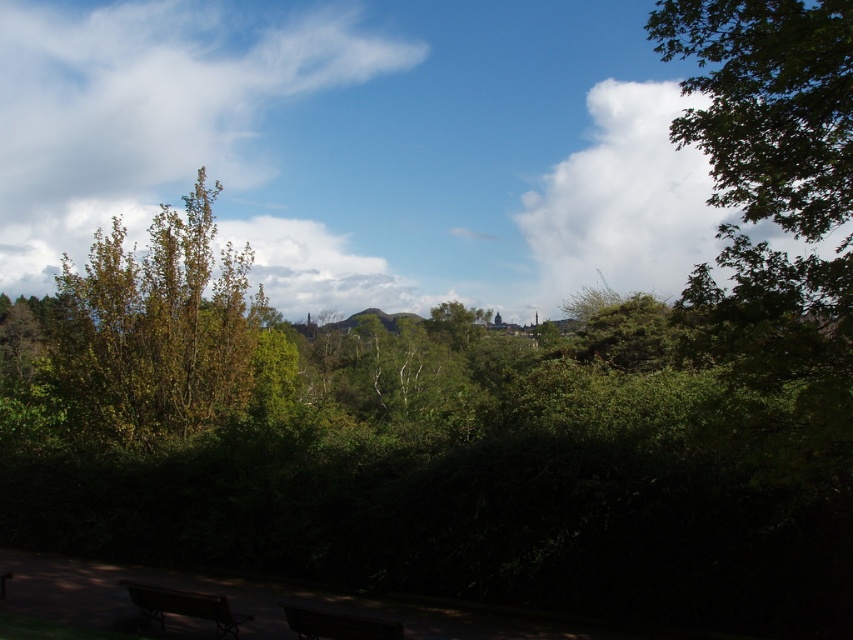
You are an architect designing a new park layout. You want to place a large statue exactly at the center of the park. However, you need to ensure that the statue does not block the view of the distant town from the white fluffy cloud at upper left. Given the coordinates of the cloud, can you determine if placing the statue at the center would block the view? Assume the park is a rectangle with coordinates from 0 to 1 on both axes.

The white fluffy cloud at upper left is located at coordinates point (173, 134). Since the statue is placed at the center of the park, which would be at coordinates (426, 320), the statue will not block the view of the distant town from the white fluffy cloud at upper left because the cloud is positioned far to the left and lower left compared to the center point.

You are planning to take a photo of the dark brown wooden bench at lower left and the white fluffy cloud at upper center. Which object should you focus on first if you want to capture both in the same frame without moving the camera?

You should focus on the white fluffy cloud at upper center first because it is taller than the dark brown wooden bench at lower left, so adjusting the camera angle to include its height might require a wider shot, ensuring both are in frame.

Consider the image. You are standing at the park entrance and see the white fluffy cloud at upper left. If you want to take a photo of it with your smartphone, which has a maximum zoom range of 10 meters, will you be able to capture the cloud clearly without moving closer?

The white fluffy cloud at upper left is 41.46 meters away from camera. Since your smartphone has a maximum zoom range of 10 meters, you won not be able to capture the cloud clearly without moving closer.